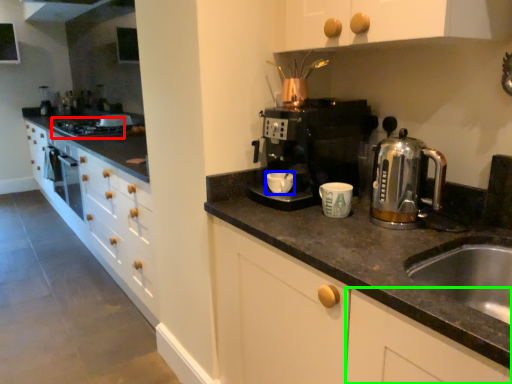
Question: Considering the real-world distances, which object is farthest from gas stove (highlighted by a red box)? mug (highlighted by a blue box) or cabinetry (highlighted by a green box)?

Choices:
 (A) mug
 (B) cabinetry

Answer: (B)